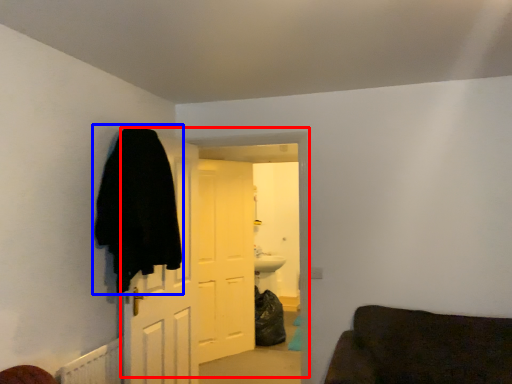
Question: Which object appears farthest to the camera in this image, door (highlighted by a red box) or cloak (highlighted by a blue box)?

Choices:
 (A) door
 (B) cloak

Answer: (A)